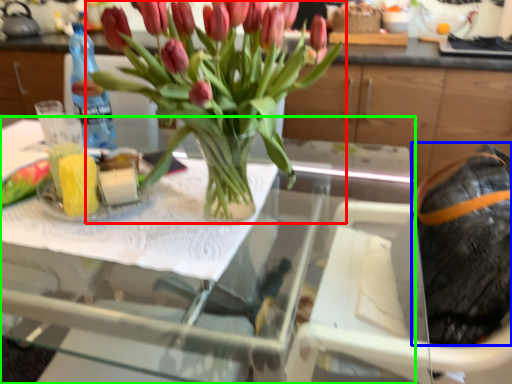
Question: Estimate the real-world distances between objects in this image. Which object is farther from houseplant (highlighted by a red box), material (highlighted by a blue box) or table (highlighted by a green box)?

Choices:
 (A) material
 (B) table

Answer: (A)